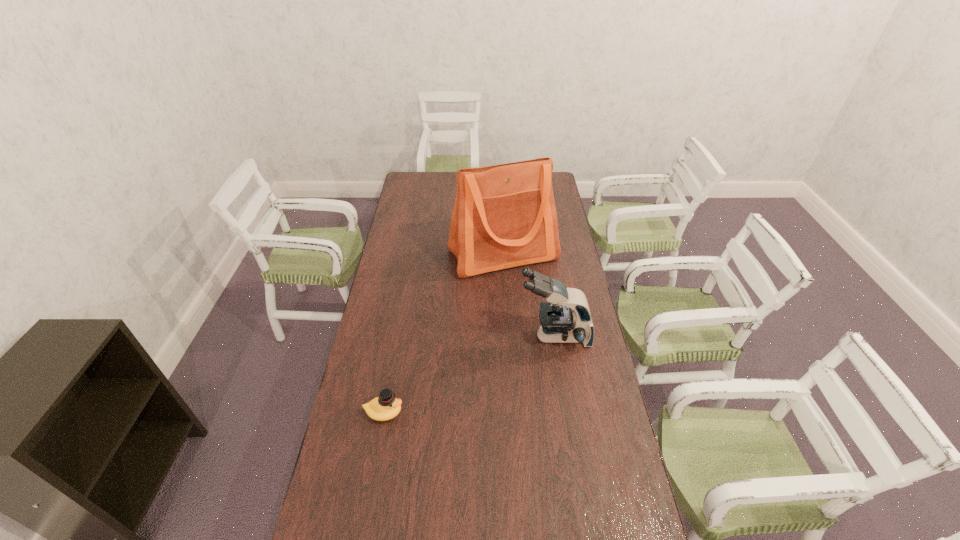
The width and height of the screenshot is (960, 540). In order to click on object that is the second closest to the second tallest object in this screenshot , I will do click(x=385, y=407).

Point out which object is positioned as the second nearest to the second farthest object. Please provide its 2D coordinates. Your answer should be formatted as a tuple, i.e. [(x, y)], where the tuple contains the x and y coordinates of a point satisfying the conditions above.

[(385, 407)]

Find the location of `vacant space that satisfies the following two spatial constraints: 1. on the front side of the farthest object; 2. on the front-facing side of the leftmost object`. vacant space that satisfies the following two spatial constraints: 1. on the front side of the farthest object; 2. on the front-facing side of the leftmost object is located at coordinates (513, 412).

I want to click on vacant space that satisfies the following two spatial constraints: 1. on the front side of the tallest object; 2. on the front-facing side of the shortest object, so click(x=513, y=412).